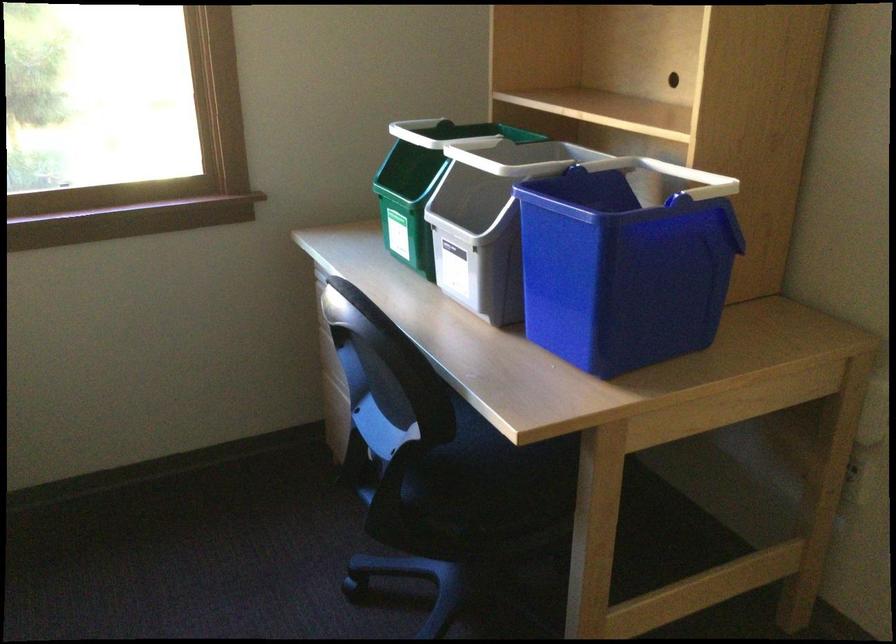
The height and width of the screenshot is (644, 896). Find the location of `chair sitting surface`. chair sitting surface is located at coordinates (479, 476).